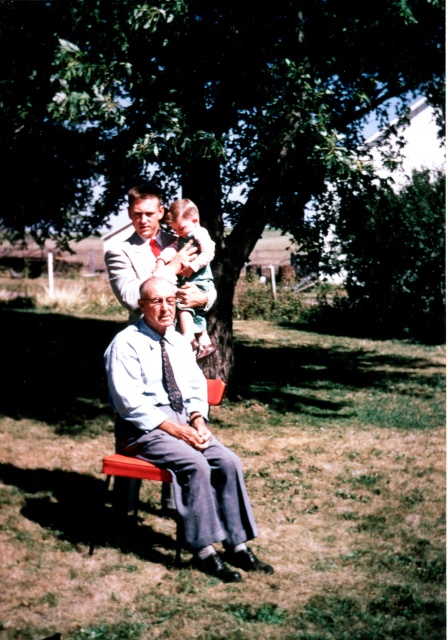
Who is taller, light blue fabric shirt at center or dark gray textured tie at center?

With more height is light blue fabric shirt at center.

Does light blue fabric shirt at center appear on the right side of dark gray textured tie at center?

Yes, light blue fabric shirt at center is to the right of dark gray textured tie at center.

Is point (206, 541) less distant than point (164, 368)?

Yes, it is.

Find the location of a particular element. light blue fabric shirt at center is located at coordinates click(179, 433).

Can you confirm if light blue fabric shirt at center is taller than light brown fabric baby at upper center?

Correct, light blue fabric shirt at center is much taller as light brown fabric baby at upper center.

Between light blue fabric shirt at center and light brown fabric baby at upper center, which one has more height?

light blue fabric shirt at center is taller.

Is point (206, 550) positioned behind point (185, 227)?

No, (206, 550) is in front of (185, 227).

Image resolution: width=448 pixels, height=640 pixels. I want to click on light blue fabric shirt at center, so click(x=179, y=433).

Is green leafy tree at upper center below light blue fabric shirt at center?

No, green leafy tree at upper center is not below light blue fabric shirt at center.

Does point (85, 93) lie behind point (136, 333)?

Yes, point (85, 93) is farther from viewer.

Locate an element on the screen. The width and height of the screenshot is (448, 640). green leafy tree at upper center is located at coordinates (199, 108).